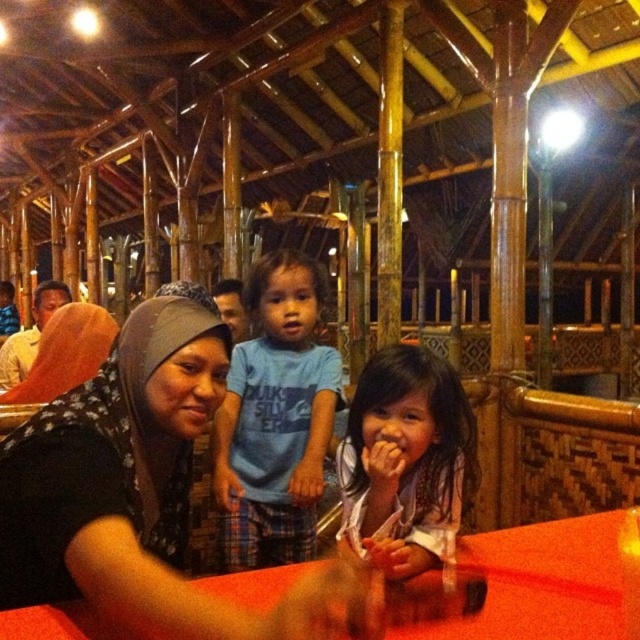
Question: Considering the relative positions of blue cotton shirt at center and smooth brown hair at center in the image provided, where is blue cotton shirt at center located with respect to smooth brown hair at center?

Choices:
 (A) above
 (B) below

Answer: (A)

Question: Does blue cotton shirt at center lie in front of smooth brown hair at center?

Choices:
 (A) no
 (B) yes

Answer: (A)

Question: Does blue cotton shirt at center appear on the right side of smooth red table at center?

Choices:
 (A) no
 (B) yes

Answer: (A)

Question: Which is nearer to the smooth red table at center?

Choices:
 (A) matte black hijab at center
 (B) blue cotton shirt at center
 (C) smooth brown hair at center

Answer: (C)

Question: Which of these objects is positioned farthest from the blue cotton shirt at center?

Choices:
 (A) smooth brown hair at center
 (B) matte black hijab at center
 (C) smooth red table at center

Answer: (C)

Question: Which object is closer to the camera taking this photo?

Choices:
 (A) matte black hijab at center
 (B) blue cotton shirt at center

Answer: (A)